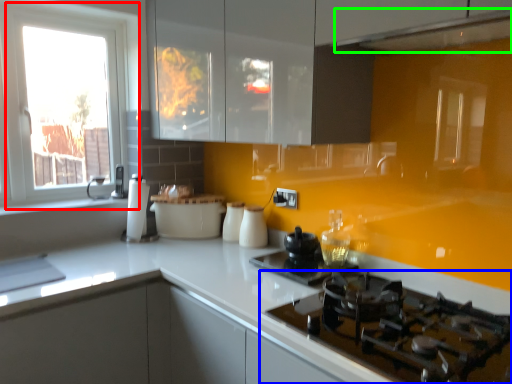
Question: Which is nearer to the window (highlighted by a red box)? gas stove (highlighted by a blue box) or exhaust hood (highlighted by a green box).

Choices:
 (A) gas stove
 (B) exhaust hood

Answer: (B)